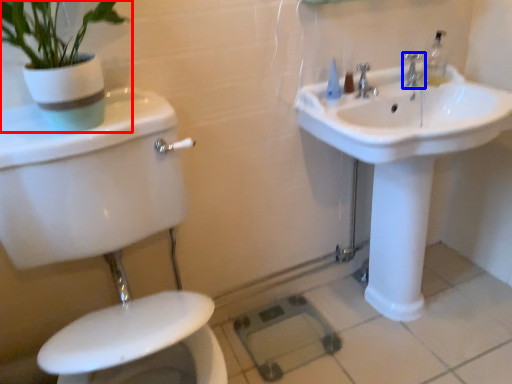
Question: Which of the following is the closest to the observer, houseplant (highlighted by a red box) or tap (highlighted by a blue box)?

Choices:
 (A) houseplant
 (B) tap

Answer: (A)